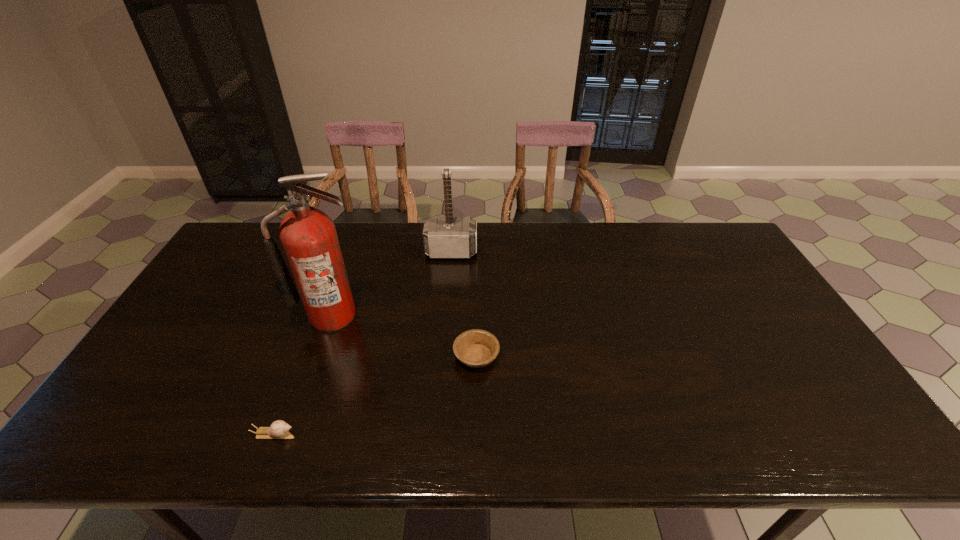
Image resolution: width=960 pixels, height=540 pixels. Find the location of `the second farthest object`. the second farthest object is located at coordinates (308, 235).

This screenshot has width=960, height=540. In order to click on the tallest object in this screenshot , I will do `click(308, 235)`.

The height and width of the screenshot is (540, 960). In order to click on the farthest object in this screenshot , I will do `click(444, 237)`.

This screenshot has width=960, height=540. In order to click on the second tallest object in this screenshot , I will do `click(444, 237)`.

You are a GUI agent. You are given a task and a screenshot of the screen. Output one action in this format:
    pyautogui.click(x=<x>, y=<y>)
    Task: Click on the nearest object
    
    Given the screenshot: What is the action you would take?
    pyautogui.click(x=279, y=429)

You are a GUI agent. You are given a task and a screenshot of the screen. Output one action in this format:
    pyautogui.click(x=<x>, y=<y>)
    Task: Click on the bowl
    
    Given the screenshot: What is the action you would take?
    pyautogui.click(x=475, y=348)

Locate an element on the screen. Image resolution: width=960 pixels, height=540 pixels. free space located on the front of the tallest object near the operation label is located at coordinates (320, 353).

Identify the location of vacant space located 0.110m for striking with the head of the third shortest object. (449, 284).

Locate an element on the screen. blank space located 0.200m on the shell of the escargot is located at coordinates (384, 434).

I want to click on vacant region located 0.060m on the left of the third farthest object, so click(x=431, y=356).